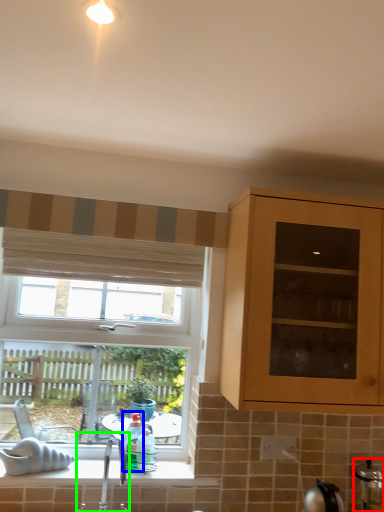
Question: Which object is the farthest from appliance (highlighted by a red box)? Choose among these: bottle (highlighted by a blue box) or tap (highlighted by a green box).

Choices:
 (A) bottle
 (B) tap

Answer: (B)